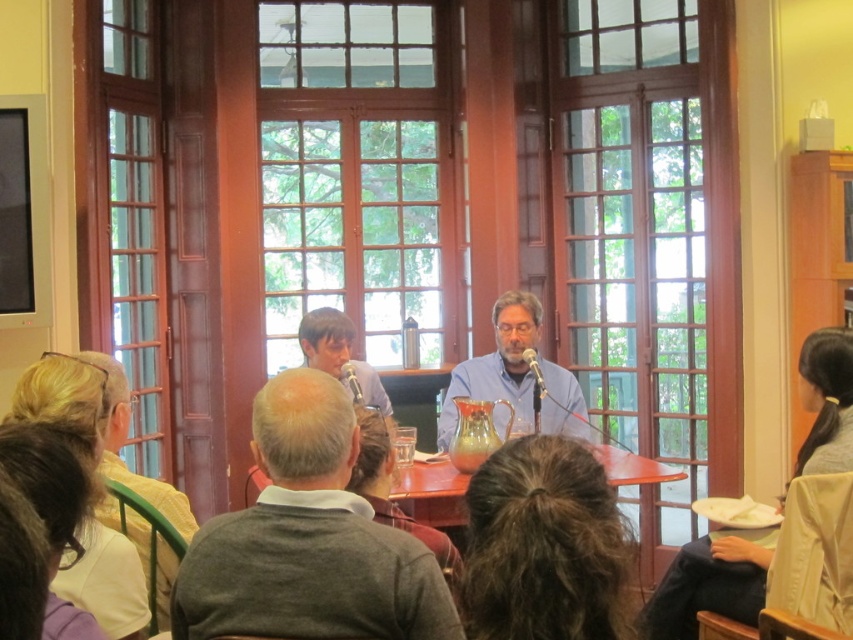
In the scene shown: Is blue shirt at center wider than light brown hair at left?

Correct, the width of blue shirt at center exceeds that of light brown hair at left.

Which is more to the left, blue shirt at center or light brown hair at left?

light brown hair at left is more to the left.

Locate an element on the screen. Image resolution: width=853 pixels, height=640 pixels. blue shirt at center is located at coordinates pos(498,364).

The width and height of the screenshot is (853, 640). Find the location of `blue shirt at center`. blue shirt at center is located at coordinates (498, 364).

Between light brown hair at left and smooth gray sweater at center, which one appears on the right side from the viewer's perspective?

smooth gray sweater at center is more to the right.

Looking at this image, does light brown hair at left have a greater height compared to smooth gray sweater at center?

Yes.

Between point (109, 448) and point (332, 349), which one is positioned in front?

Point (109, 448) is more forward.

The width and height of the screenshot is (853, 640). I want to click on light brown hair at left, so click(125, 442).

Between point (286, 529) and point (134, 520), which one is positioned in front?

Point (286, 529) is in front.

Is the position of gray sweater at center less distant than that of light brown hair at left?

Yes, gray sweater at center is in front of light brown hair at left.

Who is more forward, (305, 627) or (109, 432)?

Point (305, 627) is in front.

Identify the location of gray sweater at center. (308, 538).